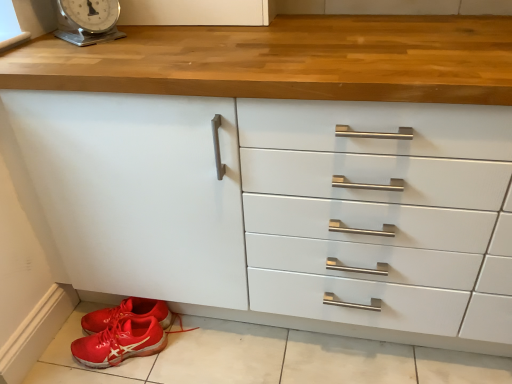
The width and height of the screenshot is (512, 384). I want to click on vacant area to the right of shiny red sneakers at lower left, so click(193, 342).